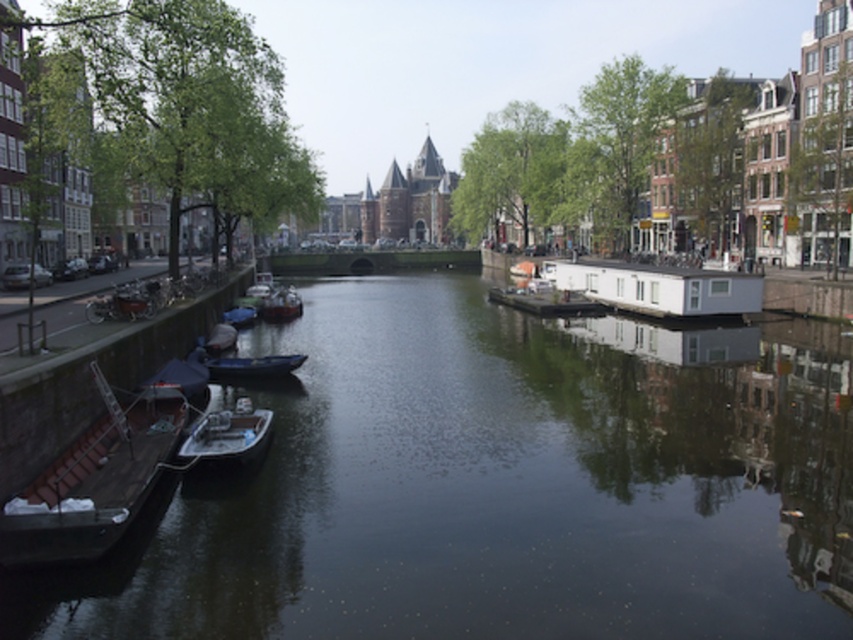
The image size is (853, 640). Describe the element at coordinates (94, 481) in the screenshot. I see `brown wooden boat at lower left` at that location.

Does brown wooden boat at lower left have a greater height compared to white glossy boat at lower left?

Yes, brown wooden boat at lower left is taller than white glossy boat at lower left.

Who is more distant from viewer, (93, 536) or (231, 410)?

Positioned behind is point (231, 410).

This screenshot has width=853, height=640. I want to click on brown wooden boat at lower left, so click(x=94, y=481).

Can you confirm if wooden boat at center is wider than white glossy boat at center?

Yes, wooden boat at center is wider than white glossy boat at center.

How distant is wooden boat at center from white glossy boat at center?

78.40 feet

Does point (212, 372) lie behind point (293, 301)?

No, it is in front of (293, 301).

Find the location of a particular element. The height and width of the screenshot is (640, 853). wooden boat at center is located at coordinates coord(252,365).

From the picture: Does green smooth water at center have a greater height compared to white glossy boat at lower left?

Yes.

Can you confirm if green smooth water at center is positioned below white glossy boat at lower left?

Actually, green smooth water at center is above white glossy boat at lower left.

This screenshot has width=853, height=640. I want to click on green smooth water at center, so click(x=494, y=486).

At what (x,y) coordinates should I click in order to perform the action: click on green smooth water at center. Please return your answer as a coordinate pair (x, y). The image size is (853, 640). Looking at the image, I should click on (494, 486).